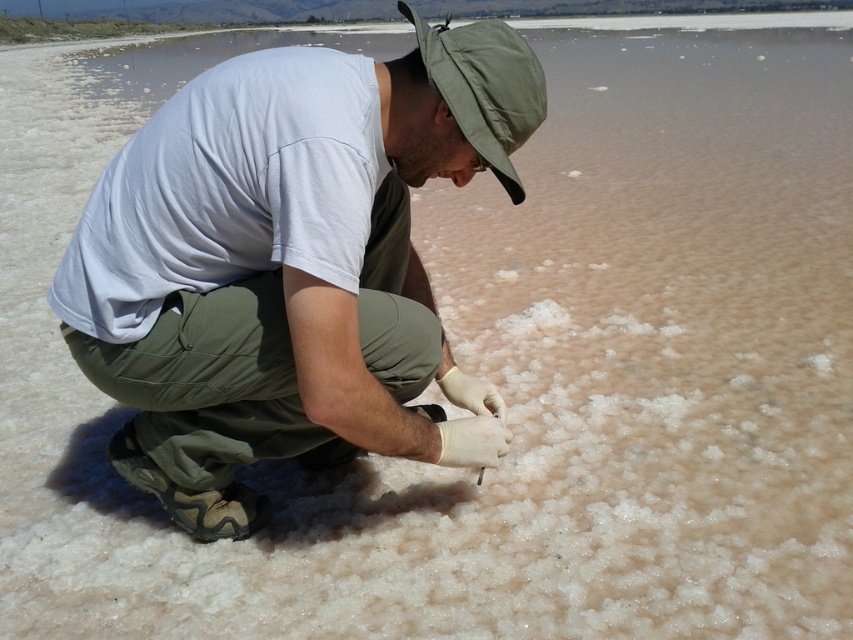
You are a photographer trying to capture the person in the image. Since you want to ensure both the matte khaki pants at center and the green fabric hat at center are clearly visible in the frame, which object should you focus on to ensure both are in focus?

You should focus on the matte khaki pants at center because it is larger in size than the green fabric hat at center, making it easier to ensure both are in focus when centered.

You are a photographer trying to capture a clear image of the green fabric hat at center while also including the matte khaki pants at center in the frame. Which object should you focus on first to ensure both are in focus?

You should focus on the matte khaki pants at center first because it is closer to the viewer than the green fabric hat at center, so adjusting focus from the closer object outward will help both be in focus.